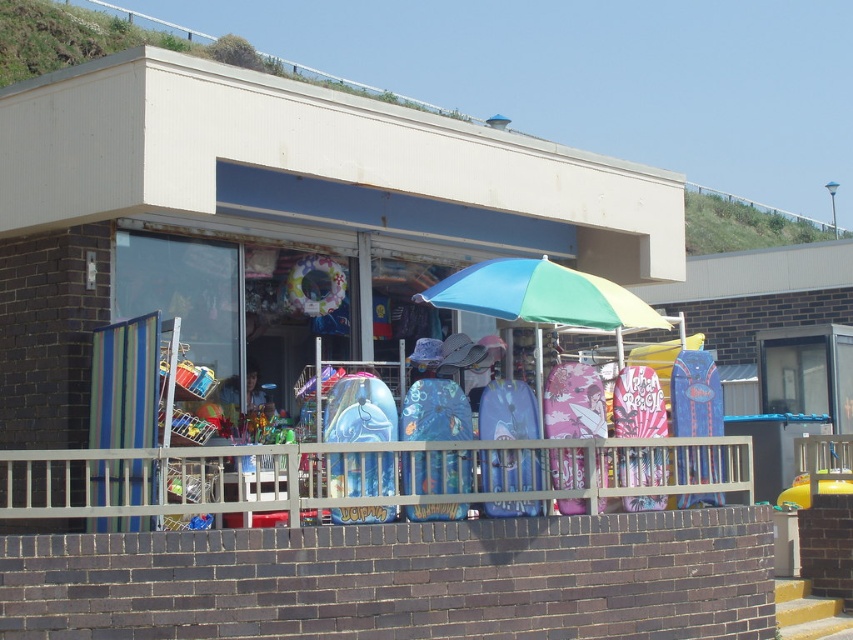
You are standing at the entrance of the beachside store and want to place a new surfboard display. There are two points marked on the ground where you can position it. The first point is at coordinates point (221, 452) and the second is at point (631, 372). Which point is closer to the store entrance?

Point (221, 452) is in front of point (631, 372), so it is closer to the store entrance.